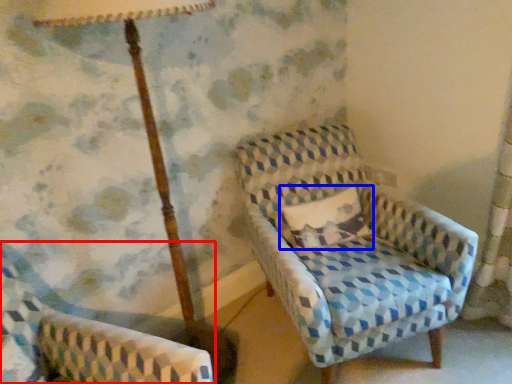
Question: Which object is closer to the camera taking this photo, chair (highlighted by a red box) or pillow (highlighted by a blue box)?

Choices:
 (A) chair
 (B) pillow

Answer: (A)